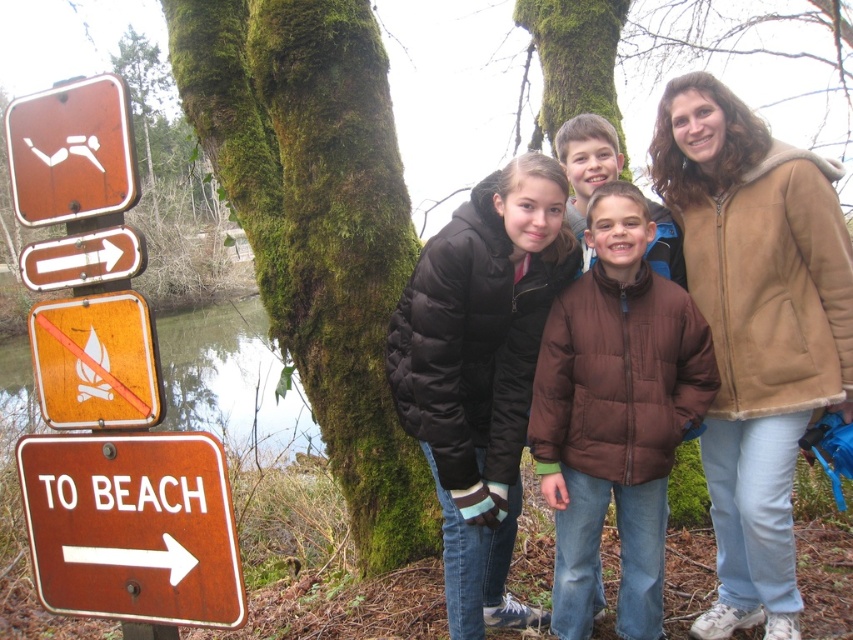
Who is more distant from viewer, (432, 300) or (79, 264)?

Point (432, 300)

Is black puffy jacket at center thinner than brown wooden sign at left?

No.

Is point (523, 196) behind point (59, 276)?

Yes, it is.

This screenshot has height=640, width=853. Identify the location of black puffy jacket at center. (480, 371).

Is point (68, 602) behind point (54, 266)?

Yes.

Is rusty metal sign at lower left smaller than brown wooden sign at left?

Incorrect, rusty metal sign at lower left is not smaller in size than brown wooden sign at left.

Find the location of a particular element. The width and height of the screenshot is (853, 640). rusty metal sign at lower left is located at coordinates (132, 528).

Who is positioned more to the right, brown sheepskin coat at center or orange wood fire sign at left?

Positioned to the right is brown sheepskin coat at center.

Does brown sheepskin coat at center have a lesser width compared to orange wood fire sign at left?

Incorrect, brown sheepskin coat at center's width is not less than orange wood fire sign at left's.

Is point (712, 237) farther from camera compared to point (80, 342)?

That is True.

I want to click on brown sheepskin coat at center, so click(756, 328).